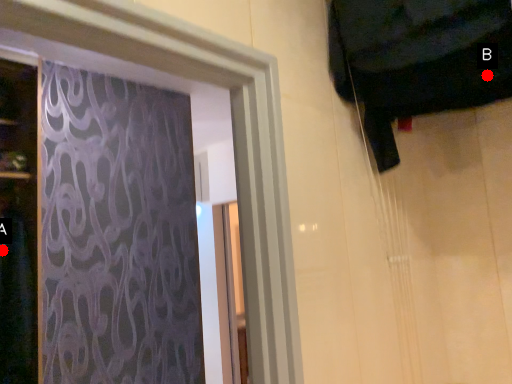
Question: Two points are circled on the image, labeled by A and B beside each circle. Which point is closer to the camera taking this photo?

Choices:
 (A) A is closer
 (B) B is closer

Answer: (B)